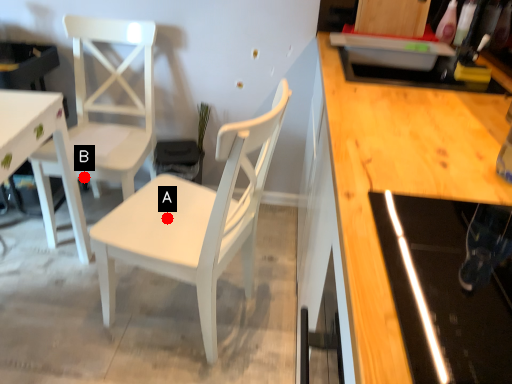
Question: Two points are circled on the image, labeled by A and B beside each circle. Which point is closer to the camera?

Choices:
 (A) A is closer
 (B) B is closer

Answer: (A)